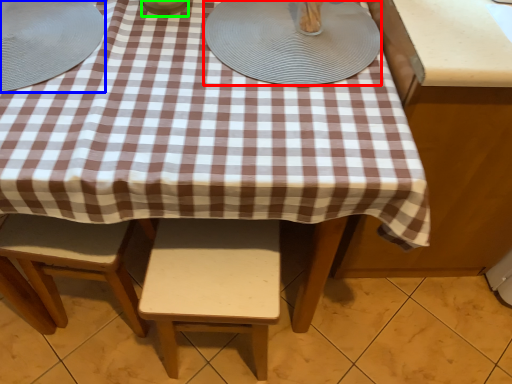
Question: Estimate the real-world distances between objects in this image. Which object is farther from platter (highlighted by a red box), tableware (highlighted by a blue box) or tableware (highlighted by a green box)?

Choices:
 (A) tableware
 (B) tableware

Answer: (A)